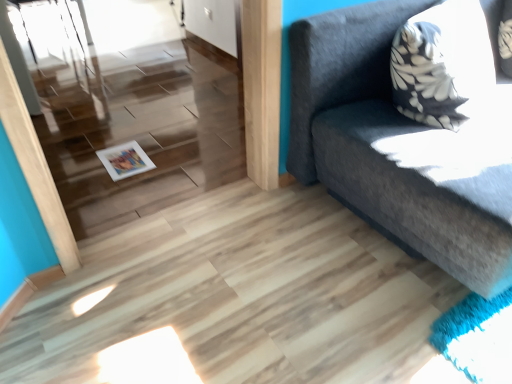
Question: Is white glossy door at upper center wider than dark gray fabric couch at upper right?

Choices:
 (A) no
 (B) yes

Answer: (A)

Question: Considering the relative positions of white glossy door at upper center and dark gray fabric couch at upper right in the image provided, is white glossy door at upper center to the left of dark gray fabric couch at upper right from the viewer's perspective?

Choices:
 (A) no
 (B) yes

Answer: (B)

Question: Does white glossy door at upper center lie behind dark gray fabric couch at upper right?

Choices:
 (A) no
 (B) yes

Answer: (B)

Question: Does white glossy door at upper center have a smaller size compared to dark gray fabric couch at upper right?

Choices:
 (A) no
 (B) yes

Answer: (B)

Question: Can you confirm if white glossy door at upper center is bigger than dark gray fabric couch at upper right?

Choices:
 (A) yes
 (B) no

Answer: (B)

Question: Is point (348, 51) closer or farther from the camera than point (132, 168)?

Choices:
 (A) closer
 (B) farther

Answer: (A)

Question: Is dark gray fabric couch at upper right in front of or behind white glossy magazine at lower left in the image?

Choices:
 (A) front
 (B) behind

Answer: (A)

Question: From the image's perspective, is dark gray fabric couch at upper right located above or below white glossy magazine at lower left?

Choices:
 (A) above
 (B) below

Answer: (A)

Question: From their relative heights in the image, would you say dark gray fabric couch at upper right is taller or shorter than white glossy magazine at lower left?

Choices:
 (A) short
 (B) tall

Answer: (B)

Question: Would you say white glossy door at upper center is inside or outside white glossy magazine at lower left?

Choices:
 (A) outside
 (B) inside

Answer: (A)

Question: Considering the positions of point (190, 21) and point (138, 167), is point (190, 21) closer or farther from the camera than point (138, 167)?

Choices:
 (A) closer
 (B) farther

Answer: (B)

Question: Considering the positions of white glossy door at upper center and white glossy magazine at lower left in the image, is white glossy door at upper center taller or shorter than white glossy magazine at lower left?

Choices:
 (A) tall
 (B) short

Answer: (A)

Question: From the image's perspective, is white glossy door at upper center positioned above or below white glossy magazine at lower left?

Choices:
 (A) above
 (B) below

Answer: (A)

Question: Considering their positions, is dark gray fabric couch at upper right located in front of or behind white glossy door at upper center?

Choices:
 (A) front
 (B) behind

Answer: (A)

Question: Is dark gray fabric couch at upper right wider or thinner than white glossy door at upper center?

Choices:
 (A) thin
 (B) wide

Answer: (B)